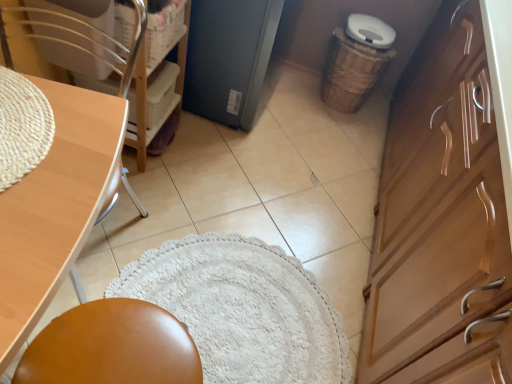
Question: From a real-world perspective, does matte black refrigerator at center stand above light brown wood desk at left?

Choices:
 (A) yes
 (B) no

Answer: (B)

Question: Can we say matte black refrigerator at center lies outside light brown wood desk at left?

Choices:
 (A) yes
 (B) no

Answer: (A)

Question: Is matte black refrigerator at center to the left of light brown wood desk at left from the viewer's perspective?

Choices:
 (A) yes
 (B) no

Answer: (B)

Question: Can you confirm if matte black refrigerator at center is positioned to the right of light brown wood desk at left?

Choices:
 (A) no
 (B) yes

Answer: (B)

Question: Is matte black refrigerator at center facing towards light brown wood desk at left?

Choices:
 (A) yes
 (B) no

Answer: (B)

Question: Is wooden cabinet at right spatially inside woven plastic basket at upper left, the 1th basket positioned from the left, or outside of it?

Choices:
 (A) inside
 (B) outside

Answer: (B)

Question: Considering the positions of point (391, 114) and point (150, 64), is point (391, 114) closer or farther from the camera than point (150, 64)?

Choices:
 (A) farther
 (B) closer

Answer: (A)

Question: Looking at their shapes, would you say wooden cabinet at right is wider or thinner than woven plastic basket at upper left, which is the second basket in right-to-left order?

Choices:
 (A) thin
 (B) wide

Answer: (B)

Question: In the image, is wooden cabinet at right on the left side or the right side of woven plastic basket at upper left, the 2th basket viewed from the back?

Choices:
 (A) right
 (B) left

Answer: (A)

Question: Is wooden chair at left situated inside light brown wood desk at left or outside?

Choices:
 (A) inside
 (B) outside

Answer: (A)

Question: In the image, is wooden chair at left positioned in front of or behind light brown wood desk at left?

Choices:
 (A) behind
 (B) front

Answer: (A)

Question: From a real-world perspective, is wooden chair at left positioned above or below light brown wood desk at left?

Choices:
 (A) above
 (B) below

Answer: (A)

Question: Looking at the image, does wooden chair at left seem bigger or smaller compared to light brown wood desk at left?

Choices:
 (A) big
 (B) small

Answer: (B)

Question: Considering the positions of point (177, 33) and point (206, 112), is point (177, 33) closer or farther from the camera than point (206, 112)?

Choices:
 (A) closer
 (B) farther

Answer: (A)

Question: In the image, is woven plastic basket at upper left, the 1th basket positioned from the left, positioned in front of or behind matte black refrigerator at center?

Choices:
 (A) behind
 (B) front

Answer: (B)